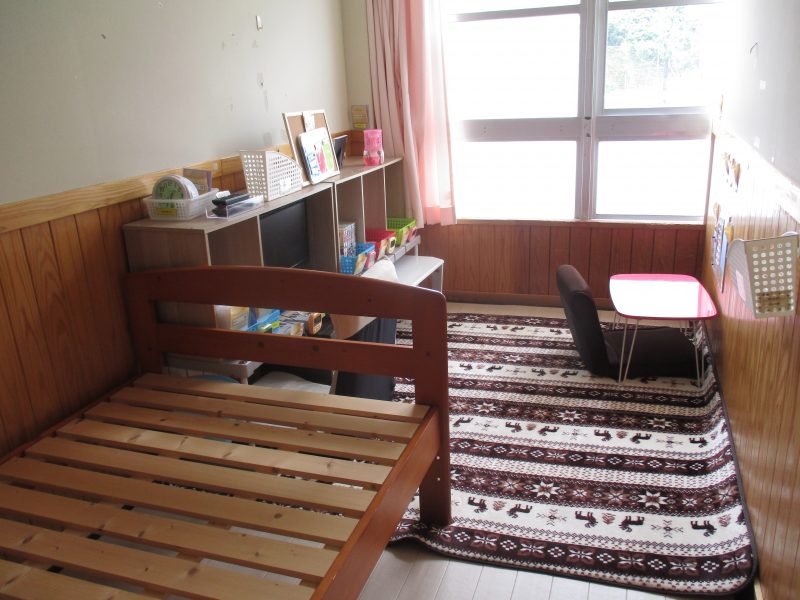
At what (x,y) coordinates should I click in order to perform the action: click on clock. Please return your answer as a coordinate pair (x, y). Looking at the image, I should click on (170, 191).